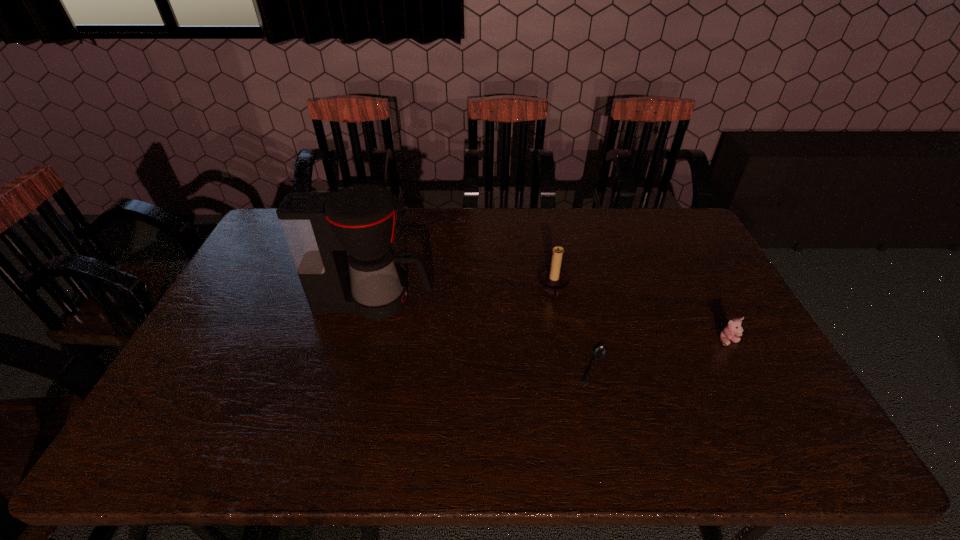
The image size is (960, 540). In order to click on object that ranks as the closest to the candle holder in this screenshot , I will do pyautogui.click(x=599, y=352).

Identify the location of object that is the second closest to the coffee maker. This screenshot has height=540, width=960. (599, 352).

The image size is (960, 540). I want to click on vacant space that satisfies the following two spatial constraints: 1. on the wick of the shortest object; 2. on the right side of the candle holder, so click(567, 367).

The height and width of the screenshot is (540, 960). Find the location of `free location that satisfies the following two spatial constraints: 1. on the wick of the second tallest object; 2. on the right side of the shortest object`. free location that satisfies the following two spatial constraints: 1. on the wick of the second tallest object; 2. on the right side of the shortest object is located at coordinates (567, 367).

The width and height of the screenshot is (960, 540). Find the location of `vacant space that satisfies the following two spatial constraints: 1. on the wick of the soupspoon; 2. on the left side of the candle holder`. vacant space that satisfies the following two spatial constraints: 1. on the wick of the soupspoon; 2. on the left side of the candle holder is located at coordinates (567, 367).